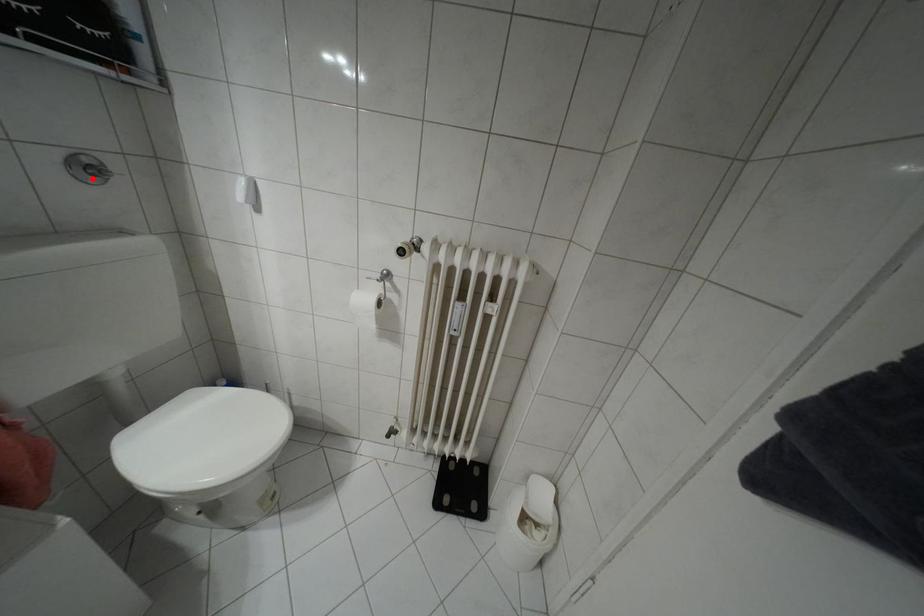
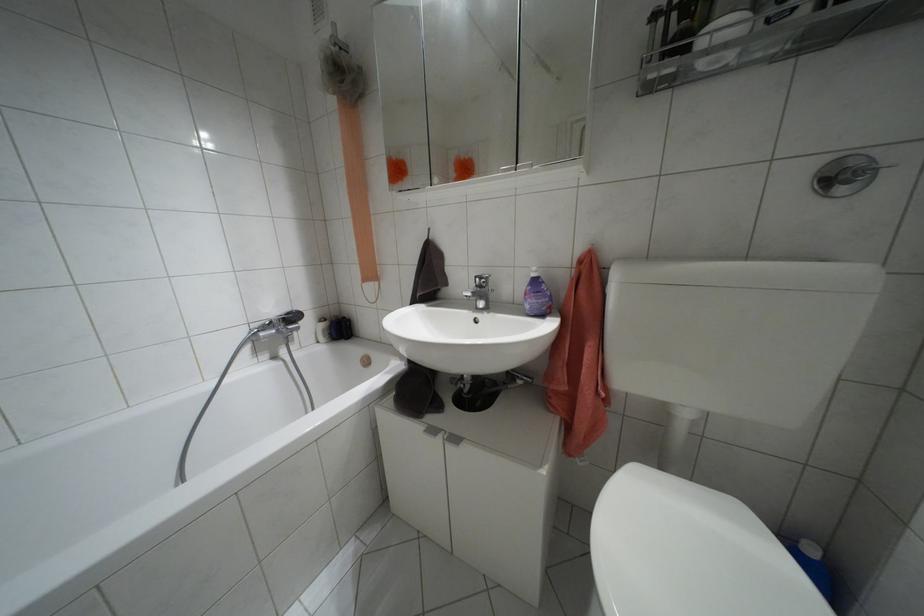
Locate, in the second image, the point that corresponds to the highlighted location in the first image.

(841, 190)